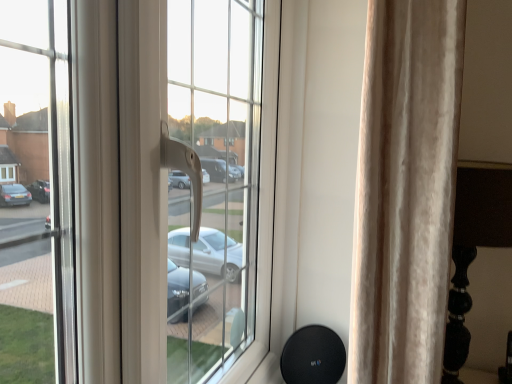
You are a GUI agent. You are given a task and a screenshot of the screen. Output one action in this format:
    pyautogui.click(x=<x>, y=<y>)
    Task: Click on the beige velvet curtain at right
    
    Given the screenshot: What is the action you would take?
    pyautogui.click(x=405, y=189)

Measure the distance between point [377,139] and camera.

Point [377,139] and camera are 25.87 inches apart from each other.

The height and width of the screenshot is (384, 512). Describe the element at coordinates (405, 189) in the screenshot. I see `beige velvet curtain at right` at that location.

Image resolution: width=512 pixels, height=384 pixels. In order to click on beige velvet curtain at right in this screenshot , I will do `click(405, 189)`.